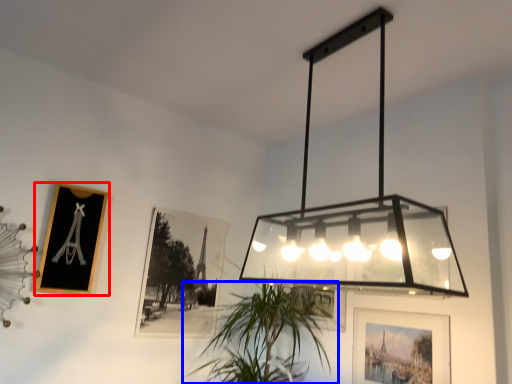
Question: Which point is closer to the camera, picture frame (highlighted by a red box) or houseplant (highlighted by a blue box)?

Choices:
 (A) picture frame
 (B) houseplant

Answer: (B)